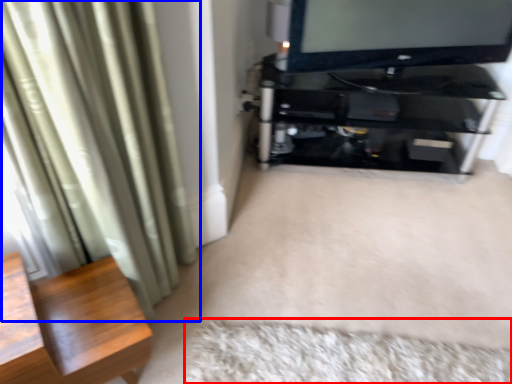
Question: Which of the following is the closest to the observer, mat (highlighted by a red box) or curtain (highlighted by a blue box)?

Choices:
 (A) mat
 (B) curtain

Answer: (B)